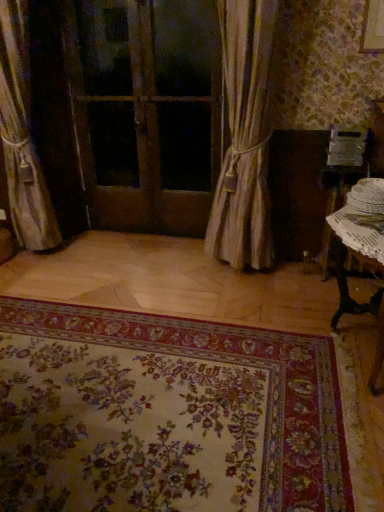
This screenshot has height=512, width=384. I want to click on free space above floral carpet at lower center (from a real-world perspective), so click(x=90, y=376).